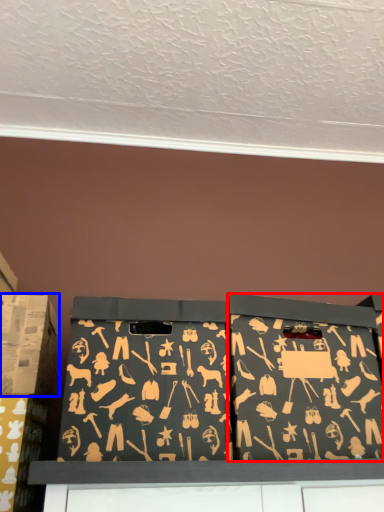
Question: Which point is closer to the camera, box (highlighted by a red box) or box (highlighted by a blue box)?

Choices:
 (A) box
 (B) box

Answer: (A)